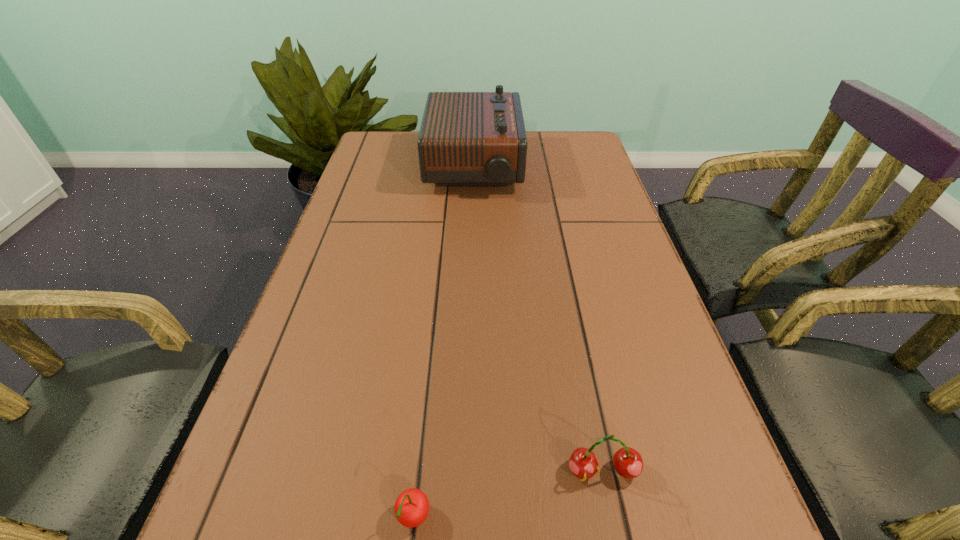
At what (x,y) coordinates should I click in order to perform the action: click on vacant space at the right edge of the desktop. Please return your answer as a coordinate pair (x, y). This screenshot has height=540, width=960. Looking at the image, I should click on (636, 411).

In the image, there is a desktop. Where is `free space at the far left corner`? free space at the far left corner is located at coordinates (404, 131).

Where is `free space at the far right corner`? Image resolution: width=960 pixels, height=540 pixels. free space at the far right corner is located at coordinates (566, 143).

The width and height of the screenshot is (960, 540). In order to click on vacant space that is in between the farthest object and the right cherry in this screenshot , I will do `click(539, 319)`.

Find the location of `vacant area that lies between the farther cherry and the tallest object`. vacant area that lies between the farther cherry and the tallest object is located at coordinates (539, 319).

This screenshot has width=960, height=540. What are the coordinates of `unoccupied position between the second nearest object and the farthest object` in the screenshot? It's located at (539, 319).

Where is `unoccupied position between the farthest object and the rightmost object`? unoccupied position between the farthest object and the rightmost object is located at coordinates (539, 319).

You are a GUI agent. You are given a task and a screenshot of the screen. Output one action in this format:
    pyautogui.click(x=<x>, y=<y>)
    Task: Click on the free space between the rightmost object and the radio receiver
    This screenshot has width=960, height=540.
    Given the screenshot: What is the action you would take?
    pyautogui.click(x=539, y=319)

Locate an element on the screen. The width and height of the screenshot is (960, 540). object that ranks as the second closest to the nearest object is located at coordinates (466, 138).

At what (x,y) coordinates should I click in order to perform the action: click on the second closest object relative to the nearest object. Please return your answer as a coordinate pair (x, y). This screenshot has height=540, width=960. Looking at the image, I should click on (466, 138).